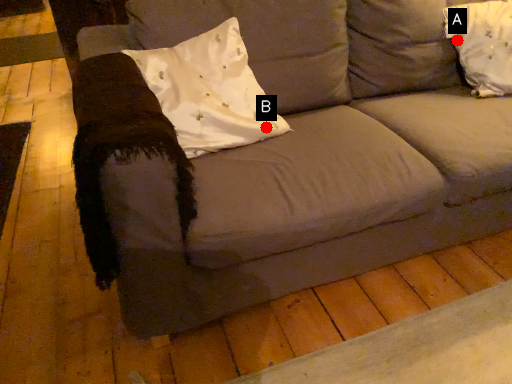
Question: Two points are circled on the image, labeled by A and B beside each circle. Which point is closer to the camera?

Choices:
 (A) A is closer
 (B) B is closer

Answer: (B)